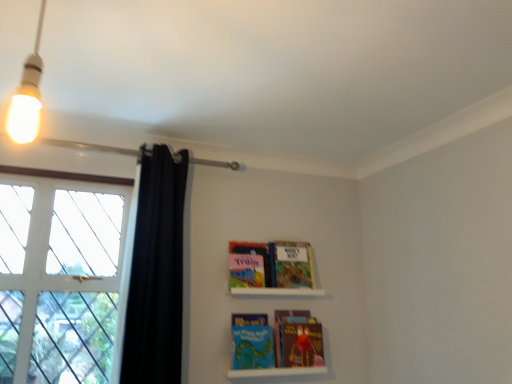
Question: Should I look upward or downward to see white glass window at left?

Choices:
 (A) down
 (B) up

Answer: (A)

Question: From the image's perspective, would you say white glass window at left is positioned over blue matte paperback book at center, the 2th paperback book positioned from the bottom?

Choices:
 (A) no
 (B) yes

Answer: (B)

Question: Considering the relative sizes of white glass window at left and blue matte paperback book at center, arranged as the third paperback book when viewed from the top, in the image provided, is white glass window at left bigger than blue matte paperback book at center, arranged as the third paperback book when viewed from the top,?

Choices:
 (A) yes
 (B) no

Answer: (A)

Question: Considering the relative sizes of white glass window at left and blue matte paperback book at center, the 2th paperback book positioned from the bottom, in the image provided, is white glass window at left wider than blue matte paperback book at center, the 2th paperback book positioned from the bottom,?

Choices:
 (A) no
 (B) yes

Answer: (B)

Question: From the image's perspective, is white glass window at left beneath blue matte paperback book at center, arranged as the third paperback book when viewed from the top?

Choices:
 (A) no
 (B) yes

Answer: (A)

Question: Is white glass window at left not near blue matte paperback book at center, the 2th paperback book positioned from the bottom?

Choices:
 (A) yes
 (B) no

Answer: (B)

Question: Can you confirm if white glass window at left is positioned to the right of blue matte paperback book at center, the 2th paperback book positioned from the bottom?

Choices:
 (A) yes
 (B) no

Answer: (B)

Question: Is white matte shelf at upper center, which is the 1th shelf from top to bottom, positioned in front of white glass window at left?

Choices:
 (A) no
 (B) yes

Answer: (A)

Question: Is white matte shelf at upper center, the second shelf ordered from the bottom, completely or partially outside of white glass window at left?

Choices:
 (A) yes
 (B) no

Answer: (A)

Question: Is white matte shelf at upper center, which is the 1th shelf from top to bottom, thinner than white glass window at left?

Choices:
 (A) yes
 (B) no

Answer: (A)

Question: Are white matte shelf at upper center, which is the 1th shelf from top to bottom, and white glass window at left far apart?

Choices:
 (A) yes
 (B) no

Answer: (B)

Question: From the image's perspective, is white matte shelf at upper center, which is the 1th shelf from top to bottom, beneath white glass window at left?

Choices:
 (A) no
 (B) yes

Answer: (B)

Question: Can you confirm if white matte shelf at upper center, which is the 1th shelf from top to bottom, is bigger than white glass window at left?

Choices:
 (A) no
 (B) yes

Answer: (A)

Question: Is matte plastic books at lower center, placed as the second shelf when sorted from top to bottom, located outside multicolored paper at lower center, which is the first paperback book in bottom-to-top order?

Choices:
 (A) no
 (B) yes

Answer: (B)